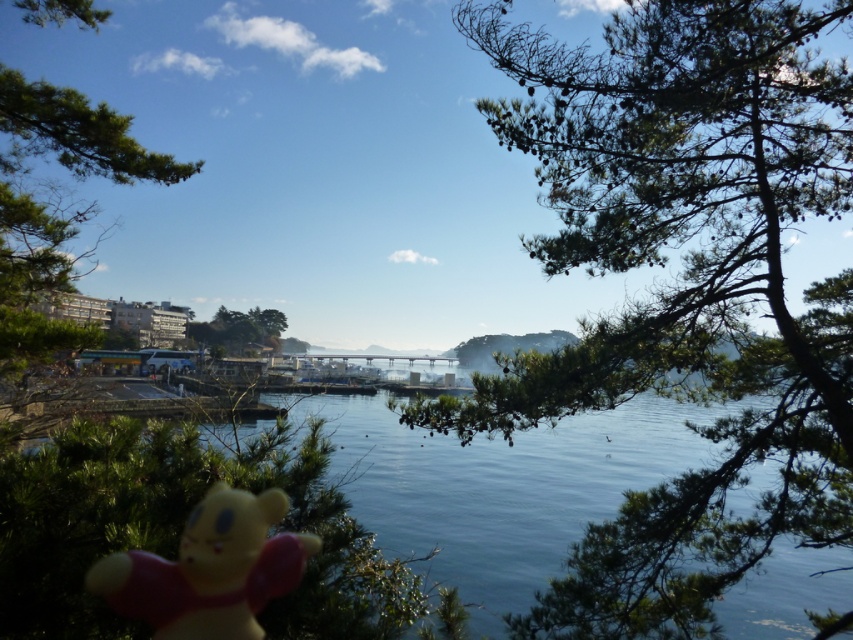
Question: Does green leafy tree at left have a lesser width compared to green matte tree at center?

Choices:
 (A) no
 (B) yes

Answer: (B)

Question: Is green leafy tree at left smaller than green matte tree at center?

Choices:
 (A) no
 (B) yes

Answer: (A)

Question: Which is farther from the yellow matte plush bear at lower left?

Choices:
 (A) green leafy tree at left
 (B) green needle-like leaves at upper center
 (C) green matte tree at center

Answer: (C)

Question: Which of the following is the farthest from the observer?

Choices:
 (A) green leafy tree at left
 (B) green needle-like leaves at upper center
 (C) green matte tree at center

Answer: (C)

Question: Is green needle-like leaves at upper center closer to the viewer compared to green leafy tree at left?

Choices:
 (A) yes
 (B) no

Answer: (B)

Question: Which of the following is the farthest from the observer?

Choices:
 (A) yellow matte plush bear at lower left
 (B) green matte tree at center

Answer: (B)